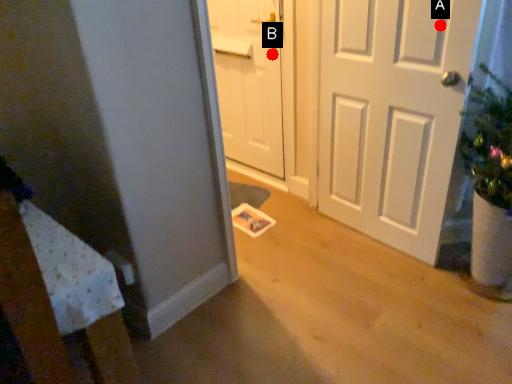
Question: Two points are circled on the image, labeled by A and B beside each circle. Among these points, which one is nearest to the camera?

Choices:
 (A) A is closer
 (B) B is closer

Answer: (A)